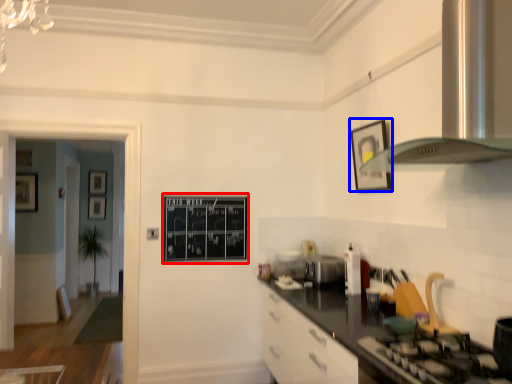
Question: Which point is closer to the camera, bulletin board (highlighted by a red box) or picture frame (highlighted by a blue box)?

Choices:
 (A) bulletin board
 (B) picture frame

Answer: (B)